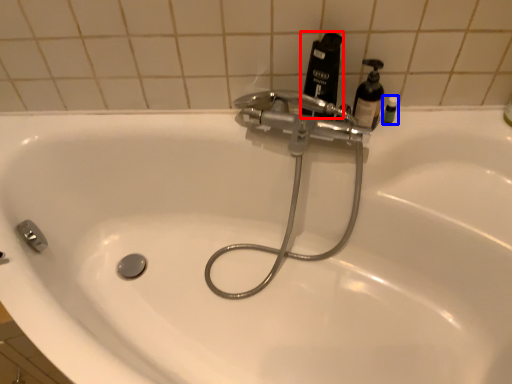
Question: Which object appears farthest to the camera in this image, mouthwash (highlighted by a red box) or toiletry (highlighted by a blue box)?

Choices:
 (A) mouthwash
 (B) toiletry

Answer: (B)